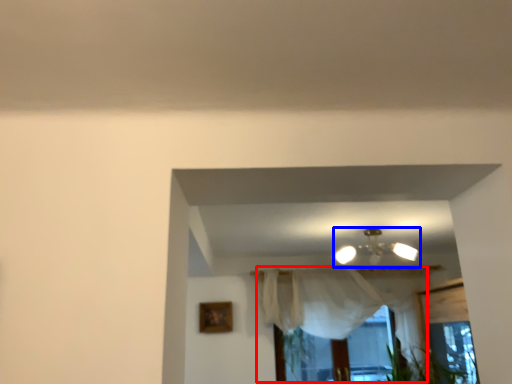
Question: Among these objects, which one is farthest to the camera, curtain (highlighted by a red box) or lamp (highlighted by a blue box)?

Choices:
 (A) curtain
 (B) lamp

Answer: (A)